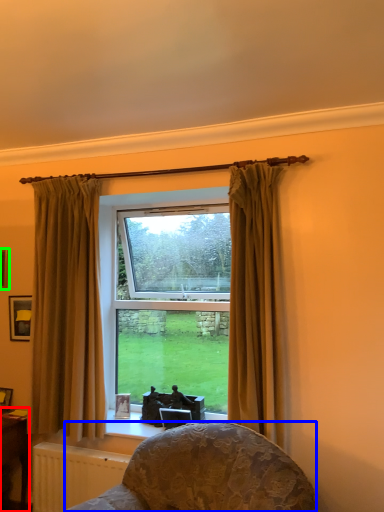
Question: Which object is the farthest from table (highlighted by a red box)? Choose among these: furniture (highlighted by a blue box) or picture frame (highlighted by a green box).

Choices:
 (A) furniture
 (B) picture frame

Answer: (A)